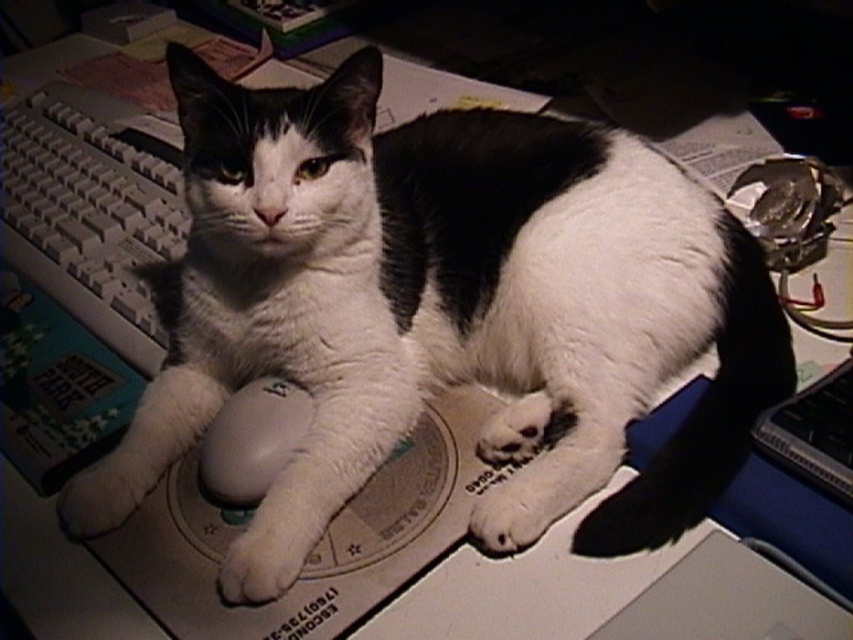
Consider the image. You are organizing your desk and want to place a new item between the white plastic keyboard at left and the white matte mouse at center. According to the current arrangement, which object is positioned higher on the desk?

The white plastic keyboard at left is located above the white matte mouse at center, so it is positioned higher on the desk.